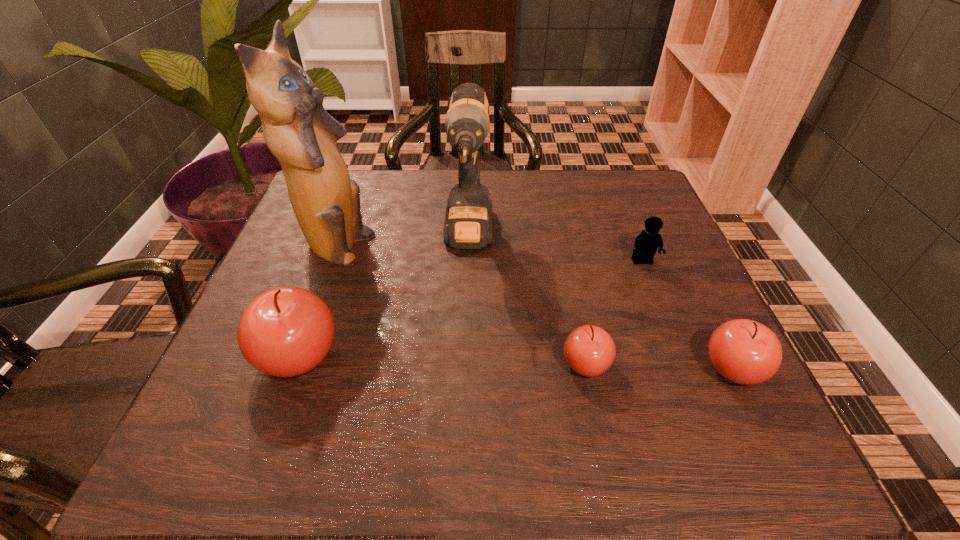
At what (x,y) coordinates should I click in order to perform the action: click on vacant space that satisfies the following two spatial constraints: 1. on the front-facing side of the second tallest apple; 2. on the right side of the Lego. Please return your answer as a coordinate pair (x, y). The image size is (960, 540). Looking at the image, I should click on (684, 368).

The width and height of the screenshot is (960, 540). I want to click on vacant area in the image that satisfies the following two spatial constraints: 1. with the drill bit of the fourth object from right to left facing forward; 2. on the left side of the rightmost apple, so (x=465, y=368).

This screenshot has width=960, height=540. In order to click on vacant space that satisfies the following two spatial constraints: 1. on the face of the fourth shortest object; 2. on the left side of the tallest object in this screenshot , I will do `click(299, 356)`.

The image size is (960, 540). What are the coordinates of `vacant point that satisfies the following two spatial constraints: 1. on the front-facing side of the Lego; 2. on the right side of the second shortest apple` in the screenshot? It's located at (684, 368).

You are a GUI agent. You are given a task and a screenshot of the screen. Output one action in this format:
    pyautogui.click(x=<x>, y=<y>)
    Task: Click on the vacant space that satisfies the following two spatial constraints: 1. with the drill bit of the third object from left to right facing forward; 2. on the face of the cat
    Image resolution: width=960 pixels, height=540 pixels.
    Given the screenshot: What is the action you would take?
    pyautogui.click(x=468, y=249)

This screenshot has height=540, width=960. Identify the location of vacant region that satisfies the following two spatial constraints: 1. on the face of the cat; 2. on the back side of the fourth object from left to right. (296, 364).

Locate an element on the screen. This screenshot has height=540, width=960. free space that satisfies the following two spatial constraints: 1. on the face of the cat; 2. on the right side of the third tallest object is located at coordinates (299, 356).

The height and width of the screenshot is (540, 960). I want to click on vacant space that satisfies the following two spatial constraints: 1. with the drill bit of the fourth object from right to left facing forward; 2. on the face of the cat, so click(x=468, y=249).

Locate an element on the screen. This screenshot has width=960, height=540. vacant space that satisfies the following two spatial constraints: 1. on the face of the cat; 2. on the left side of the shortest apple is located at coordinates (296, 364).